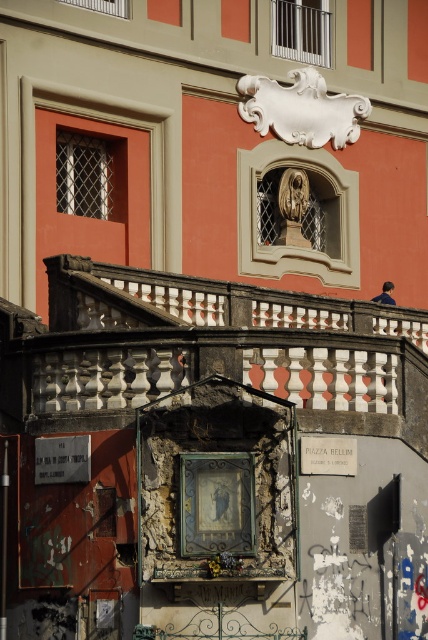
Question: Does metallic gold clock at center appear under white stone plaque at lower left?

Choices:
 (A) yes
 (B) no

Answer: (A)

Question: Which of these objects is positioned farthest from the white stone plaque at lower left?

Choices:
 (A) metallic gold clock at center
 (B) white matte plaque at center

Answer: (B)

Question: Is metallic gold clock at center to the left of white matte plaque at center from the viewer's perspective?

Choices:
 (A) no
 (B) yes

Answer: (B)

Question: Which point is farther to the camera?

Choices:
 (A) pos(50,461)
 (B) pos(214,493)
 (C) pos(330,435)

Answer: (A)

Question: Does white stone plaque at lower left come in front of white matte plaque at center?

Choices:
 (A) no
 (B) yes

Answer: (A)

Question: Which object appears farthest from the camera in this image?

Choices:
 (A) white stone plaque at lower left
 (B) white matte plaque at center
 (C) metallic gold clock at center

Answer: (A)